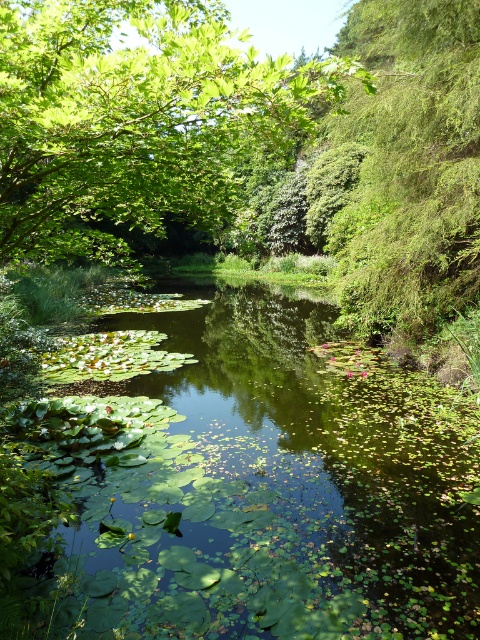
You are standing at the edge of the pond and want to take a photo of the green leafy river at center and the green leafy tree at upper left. Which object is closer to the camera based on their positions?

The green leafy river at center is positioned under the green leafy tree at upper left, so the river is closer to the camera than the tree.

You are a painter planning to sketch this scene. You want to focus on the green leafy river at center and the green leafy tree at upper left. Which one should you spend more time detailing if you want to capture their sizes accurately?

The green leafy tree at upper left occupies more space in the scene than the green leafy river at center, so you should spend more time detailing the green leafy tree at upper left to accurately capture their sizes.